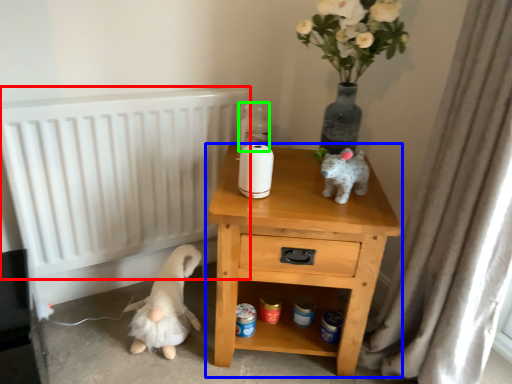
Question: Considering the real-world distances, which object is closest to radiator (highlighted by a red box)? nightstand (highlighted by a blue box) or bottle (highlighted by a green box).

Choices:
 (A) nightstand
 (B) bottle

Answer: (B)